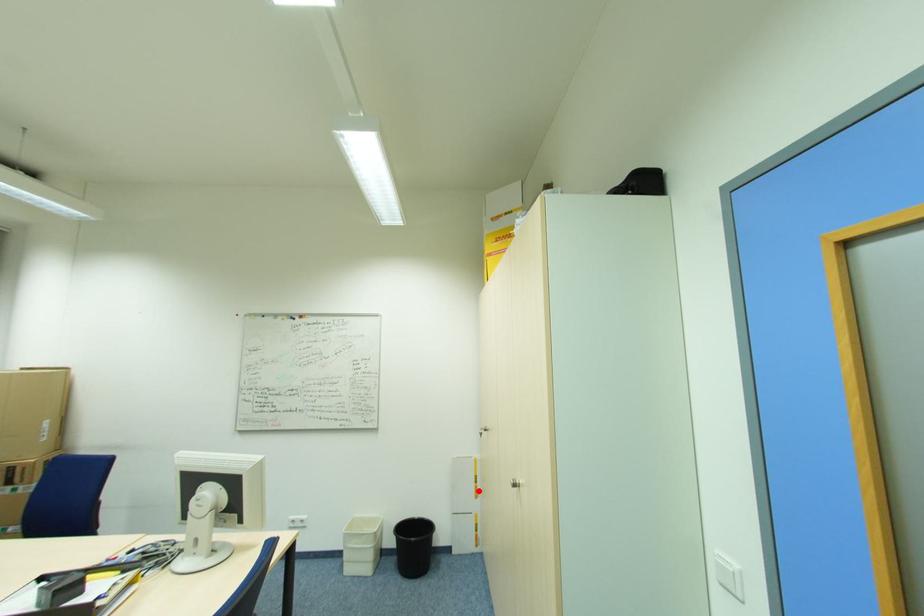
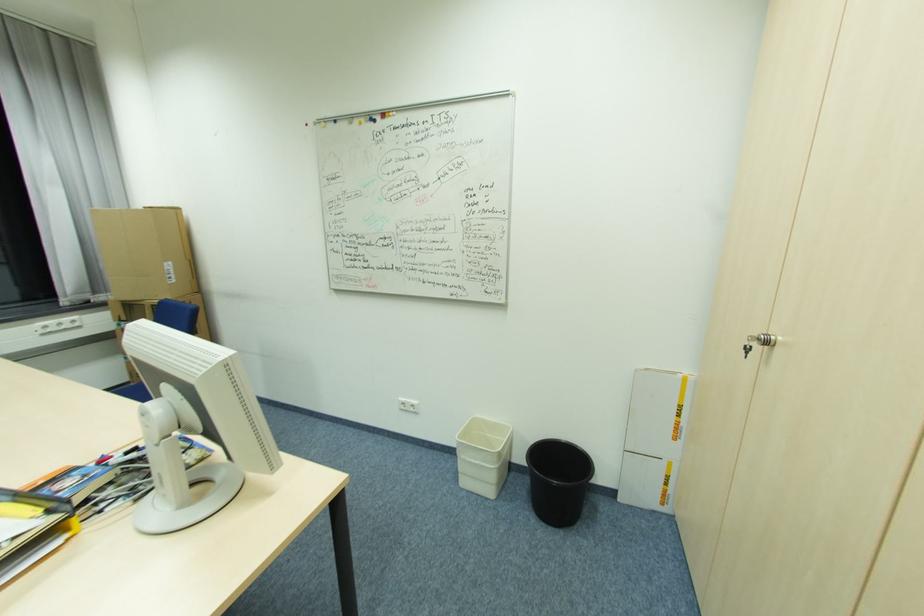
Find the pixel in the second image that matches the highlighted location in the first image.

(681, 430)